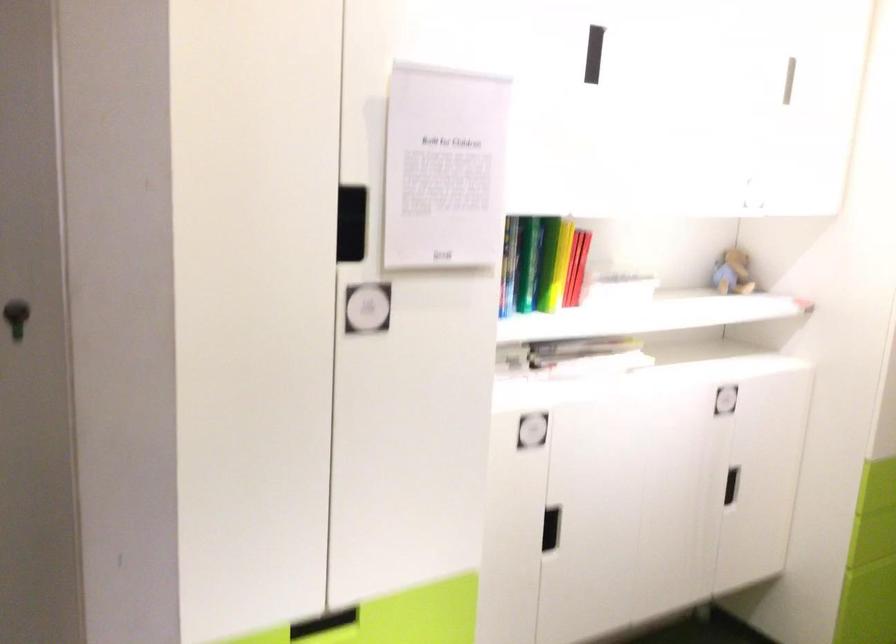
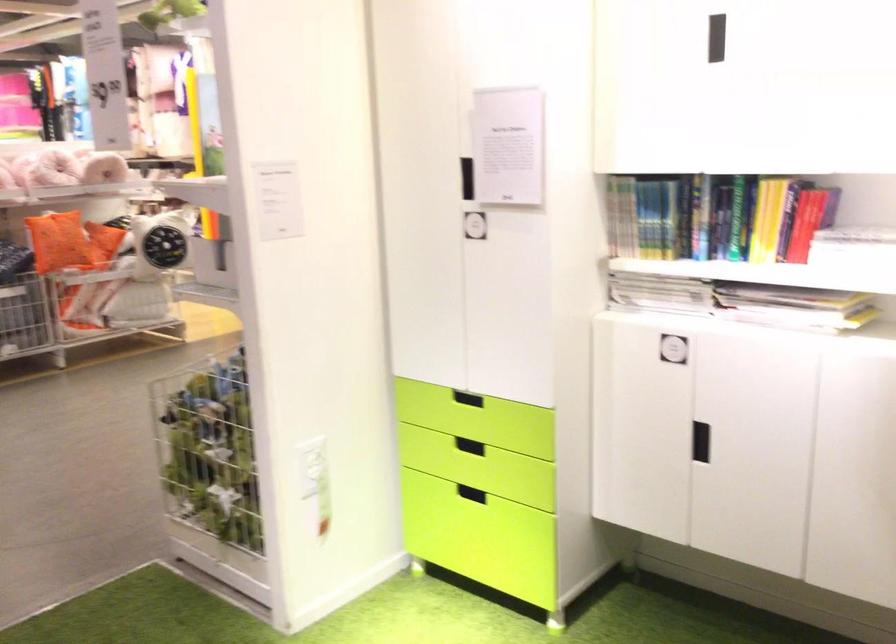
The point at (598, 357) is marked in the first image. Where is the corresponding point in the second image?

(794, 307)